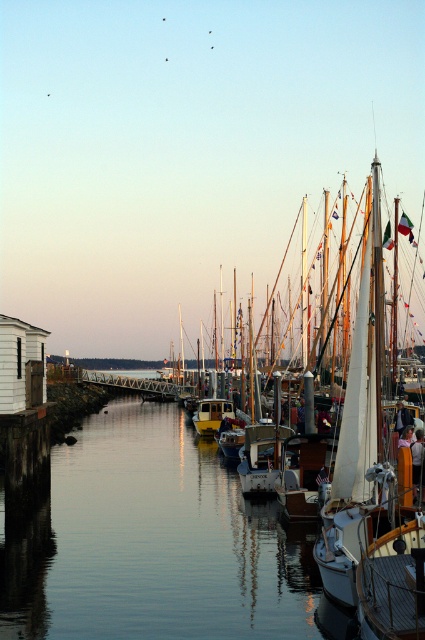
In the scene shown: You are a photographer planning to take a wide shot of the marina. You want to ensure both the smooth water at center and the yellow matte boat at center are fully visible in your frame. Given the scene described, which object will occupy more horizontal space in the photo?

The smooth water at center will occupy more horizontal space in the photo because its width is larger than that of the yellow matte boat at center.

You are a boat operator who needs to navigate a 10.2 meter long vessel through the marina. Based on the scene, can you safely pass between the smooth water at center and the yellow matte boat at center without touching either?

The distance between the smooth water at center and the yellow matte boat at center is 9.70 meters. Since the vessel is 10.2 meters long, it cannot safely pass through this gap as the distance is shorter than the boat length.

You are standing on the wooden pier and want to take a photo of the yellow matte boat at center. To avoid the smooth water at center from blocking the view, should you move closer or farther away from the boat?

Since the smooth water at center is closer to the viewer than the yellow matte boat at center, you should move farther away from the boat to position yourself behind the water and get a clear view of the boat.